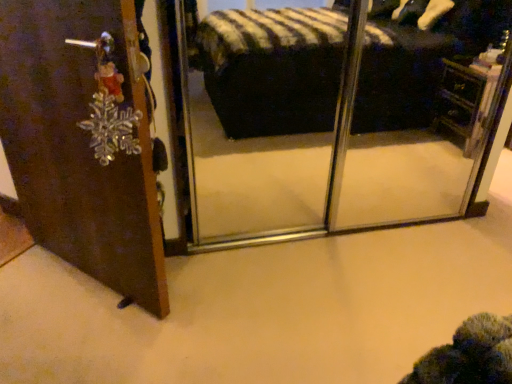
Locate an element on the screen. vacant region under brown wooden door at left (from a real-world perspective) is located at coordinates (83, 277).